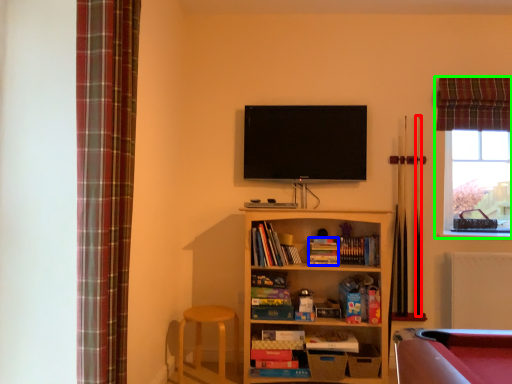
Question: Estimate the real-world distances between objects in this image. Which object is farther from cue (highlighted by a red box), book (highlighted by a blue box) or window (highlighted by a green box)?

Choices:
 (A) book
 (B) window

Answer: (A)